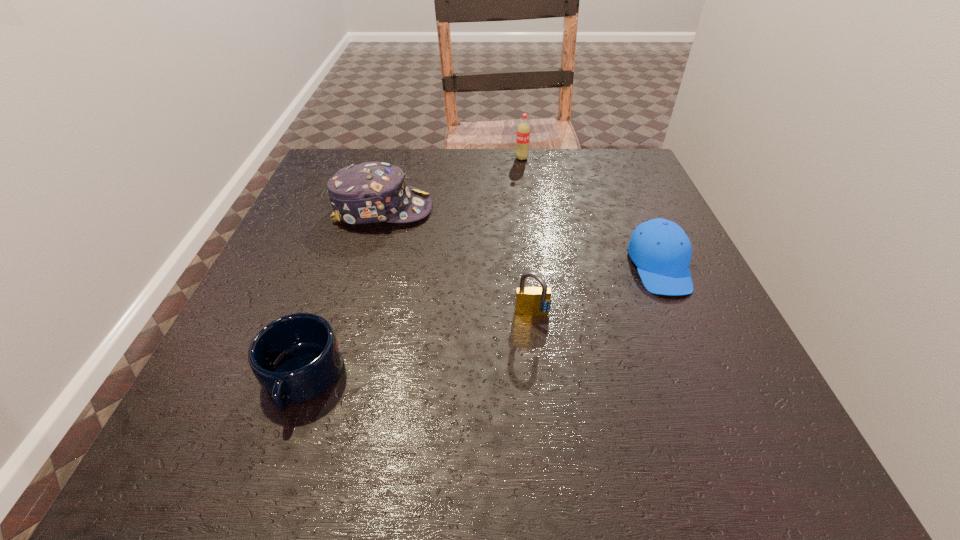
Where is `the farthest object`? This screenshot has width=960, height=540. the farthest object is located at coordinates (523, 130).

Where is `the farther cap`? the farther cap is located at coordinates (370, 192).

You are a GUI agent. You are given a task and a screenshot of the screen. Output one action in this format:
    pyautogui.click(x=<x>, y=<y>)
    Task: Click on the taller cap
    
    Given the screenshot: What is the action you would take?
    pyautogui.click(x=370, y=192)

Locate an element on the screen. This screenshot has height=540, width=960. the fourth farthest object is located at coordinates (531, 301).

The width and height of the screenshot is (960, 540). Find the location of `the third nearest object`. the third nearest object is located at coordinates (661, 250).

Identify the location of the shorter cap. (661, 250).

The width and height of the screenshot is (960, 540). I want to click on mug, so (x=295, y=358).

I want to click on vacant space located on the front of the soda, so click(x=535, y=250).

Where is `free space located 0.200m on the front-facing side of the left cap`? free space located 0.200m on the front-facing side of the left cap is located at coordinates (522, 209).

At what (x,y) coordinates should I click in order to perform the action: click on free spot located on the side with the combination dials of the padlock. Please return your answer as a coordinate pair (x, y). The height and width of the screenshot is (540, 960). Looking at the image, I should click on (538, 358).